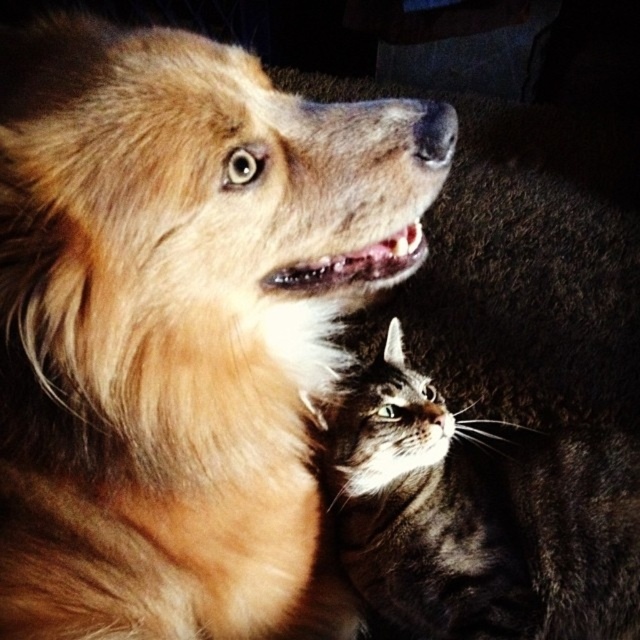
From the picture: Who is positioned more to the left, golden fur dog at upper left or tabby fur cat at center?

golden fur dog at upper left

Does golden fur dog at upper left have a lesser height compared to tabby fur cat at center?

In fact, golden fur dog at upper left may be taller than tabby fur cat at center.

Is point (145, 333) closer to viewer compared to point (362, 372)?

Yes, point (145, 333) is closer to viewer.

Locate an element on the screen. golden fur dog at upper left is located at coordinates (180, 326).